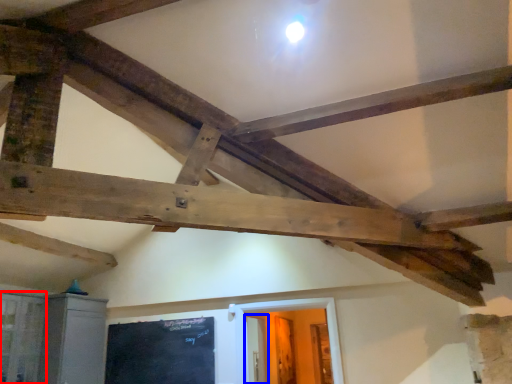
Question: Which point is further to the camera, window (highlighted by a red box) or door (highlighted by a blue box)?

Choices:
 (A) window
 (B) door

Answer: (B)